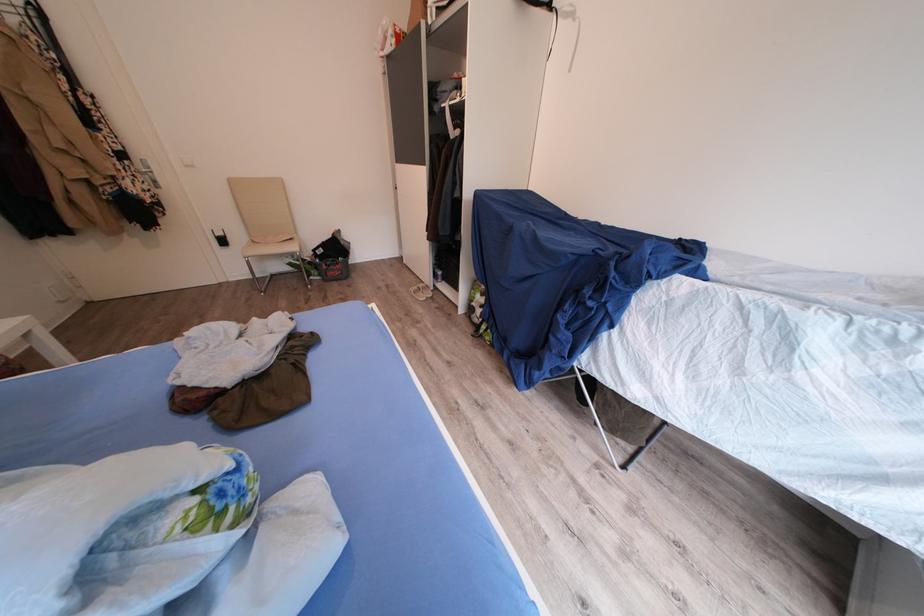
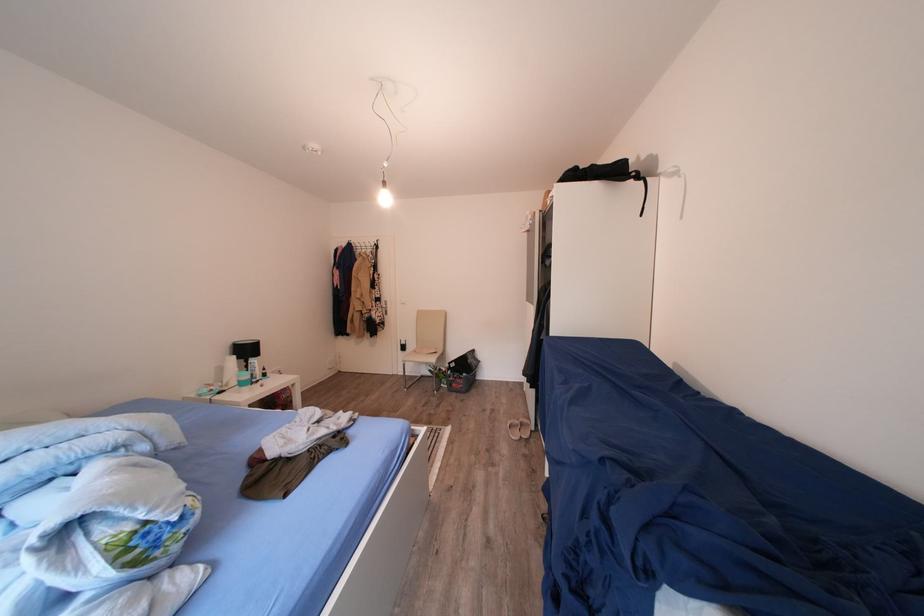
The point at [213,507] is marked in the first image. Where is the corresponding point in the second image?

(142, 538)